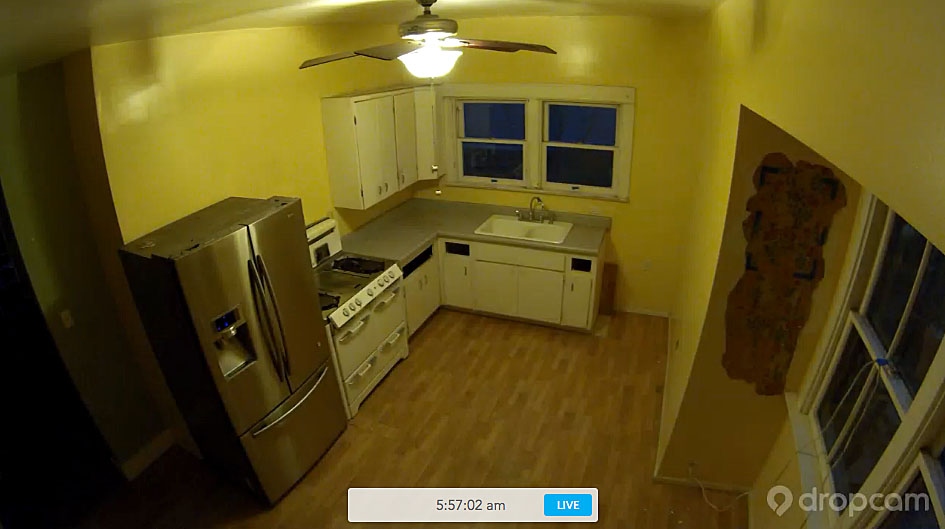
Find the location of a particular element. The width and height of the screenshot is (945, 529). sink is located at coordinates (535, 228).